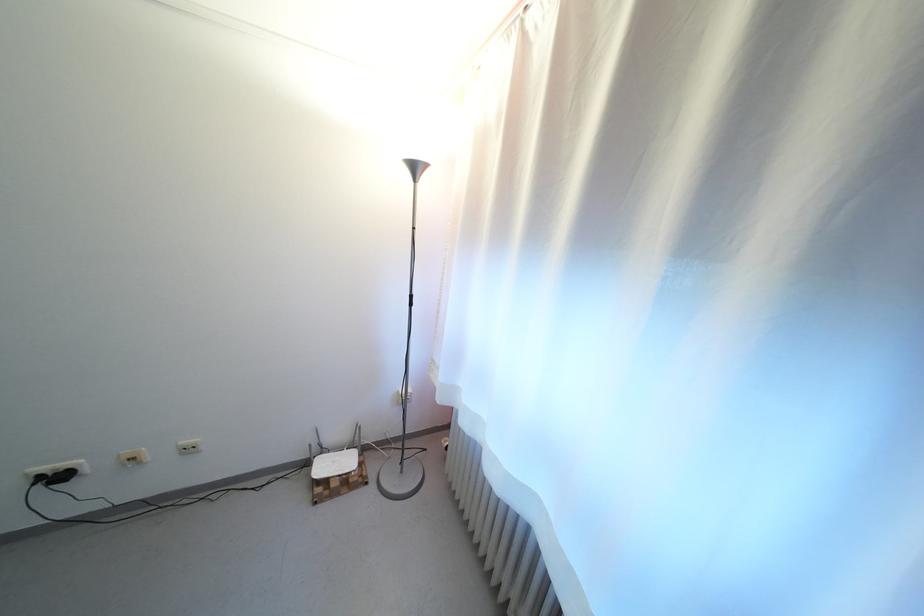
The height and width of the screenshot is (616, 924). What do you see at coordinates (54, 477) in the screenshot?
I see `a black electrical plug` at bounding box center [54, 477].